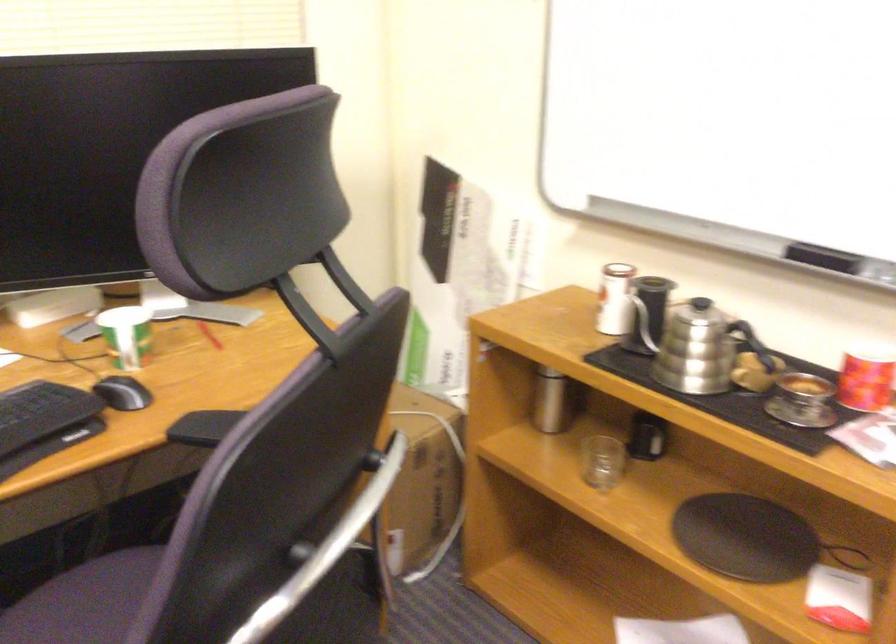
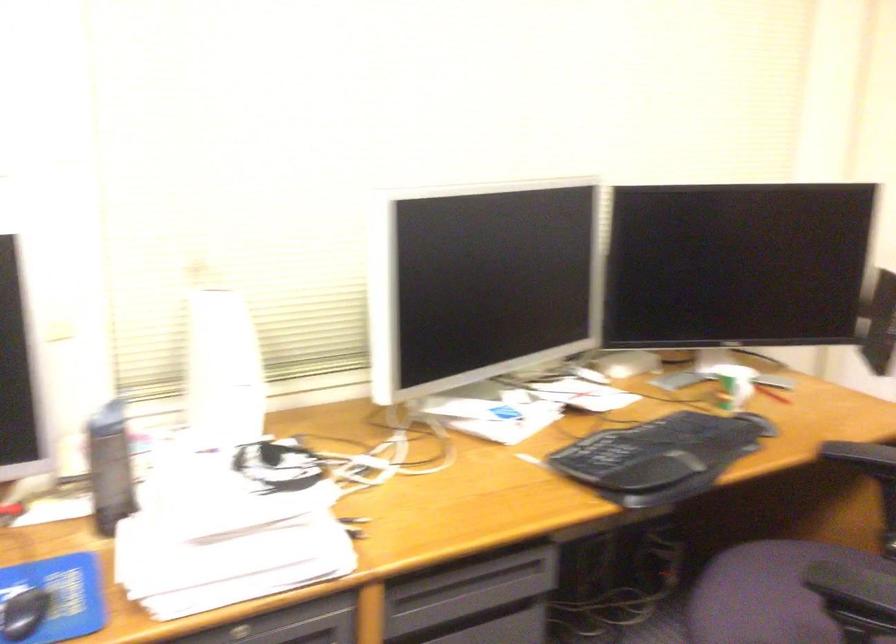
Question: The first image is from the beginning of the video and the second image is from the end. How did the camera likely rotate when shooting the video?

Choices:
 (A) Left
 (B) Right
 (C) Up
 (D) Down

Answer: (A)